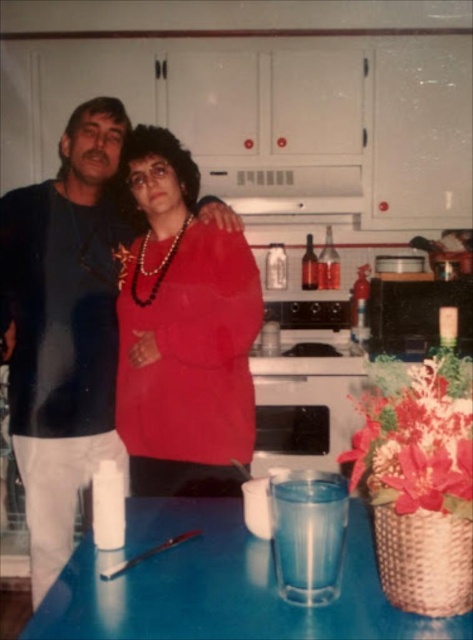
Can you confirm if blue plastic table at lower center is bigger than white matte exhaust hood at upper center?

Actually, blue plastic table at lower center might be smaller than white matte exhaust hood at upper center.

Which of these two, blue plastic table at lower center or white matte exhaust hood at upper center, stands shorter?

Standing shorter between the two is blue plastic table at lower center.

Which is behind, point (375, 564) or point (262, 173)?

Positioned behind is point (262, 173).

Locate an element on the screen. The height and width of the screenshot is (640, 473). blue plastic table at lower center is located at coordinates (219, 586).

Is matte black shirt at left to the left of white matte exhaust hood at upper center from the viewer's perspective?

Indeed, matte black shirt at left is positioned on the left side of white matte exhaust hood at upper center.

Locate an element on the screen. Image resolution: width=473 pixels, height=640 pixels. matte black shirt at left is located at coordinates (63, 328).

The height and width of the screenshot is (640, 473). In order to click on matte black shirt at left in this screenshot , I will do `click(63, 328)`.

Does matte red sweater at center have a lesser height compared to blue plastic table at lower center?

No.

Does matte red sweater at center appear on the right side of blue plastic table at lower center?

In fact, matte red sweater at center is to the left of blue plastic table at lower center.

What do you see at coordinates (183, 332) in the screenshot? I see `matte red sweater at center` at bounding box center [183, 332].

This screenshot has width=473, height=640. In order to click on matte red sweater at center in this screenshot , I will do `click(183, 332)`.